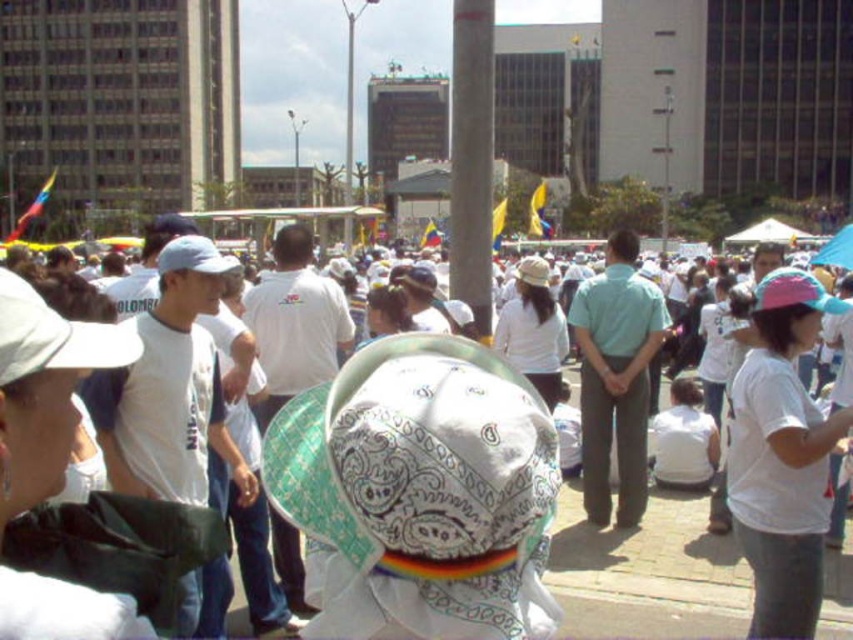
Question: Which of the following is the farthest from the observer?

Choices:
 (A) white cotton shirt at center
 (B) pink fabric cap at center

Answer: (A)

Question: In this image, where is white printed fabric baseball hat at center located relative to pink fabric cap at center?

Choices:
 (A) left
 (B) right

Answer: (A)

Question: Does white printed fabric baseball hat at center appear on the right side of pink fabric cap at center?

Choices:
 (A) no
 (B) yes

Answer: (A)

Question: Which of the following is the farthest from the observer?

Choices:
 (A) (747, 404)
 (B) (738, 616)
 (C) (486, 65)

Answer: (C)

Question: Is white printed fabric baseball hat at center above smooth concrete pole at center?

Choices:
 (A) no
 (B) yes

Answer: (A)

Question: Estimate the real-world distances between objects in this image. Which object is closer to the pink fabric cap at center?

Choices:
 (A) white cotton shirt at center
 (B) smooth concrete pole at center
 (C) white printed fabric baseball hat at center

Answer: (A)